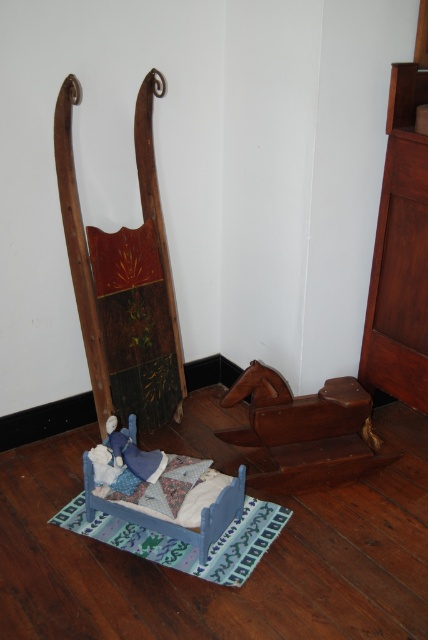
Does mahogany wood dresser at right have a larger size compared to wooden rocking horse at lower right?

Yes, mahogany wood dresser at right is bigger than wooden rocking horse at lower right.

Is point (394, 364) more distant than point (250, 390)?

Yes, it is behind point (250, 390).

Locate an element on the screen. mahogany wood dresser at right is located at coordinates (400, 253).

Looking at this image, does wooden rocking horse at lower right have a smaller size compared to blue fabric mat at center?

No, wooden rocking horse at lower right is not smaller than blue fabric mat at center.

Measure the distance between wooden rocking horse at lower right and camera.

wooden rocking horse at lower right and camera are 6.30 feet apart from each other.

You are a GUI agent. You are given a task and a screenshot of the screen. Output one action in this format:
    pyautogui.click(x=<x>, y=<y>)
    Task: Click on the wooden rocking horse at lower right
    The image size is (428, 640).
    Given the screenshot: What is the action you would take?
    pyautogui.click(x=306, y=432)

Is blue fabric mat at center taller than quilted fabric pillow at center?

Yes.

Can you confirm if blue fabric mat at center is positioned below quilted fabric pillow at center?

Indeed, blue fabric mat at center is positioned under quilted fabric pillow at center.

This screenshot has height=640, width=428. Find the location of `blue fabric mat at center`. blue fabric mat at center is located at coordinates (184, 541).